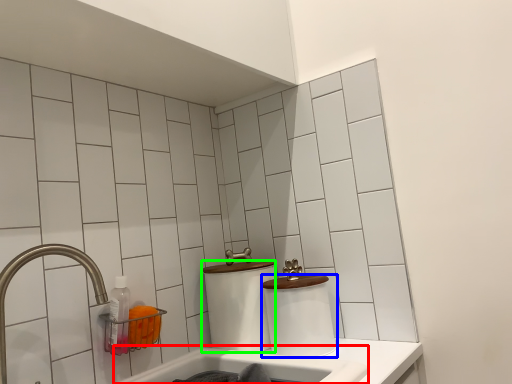
Question: Which is farther away from bath (highlighted by a red box)? toilet paper (highlighted by a blue box) or toilet paper (highlighted by a green box)?

Choices:
 (A) toilet paper
 (B) toilet paper

Answer: (B)